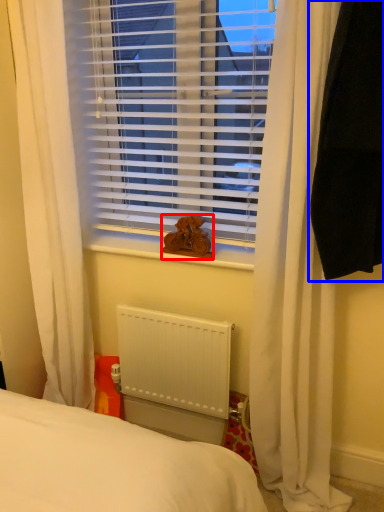
Question: Which object is closer to the camera taking this photo, animal (highlighted by a red box) or curtain (highlighted by a blue box)?

Choices:
 (A) animal
 (B) curtain

Answer: (B)